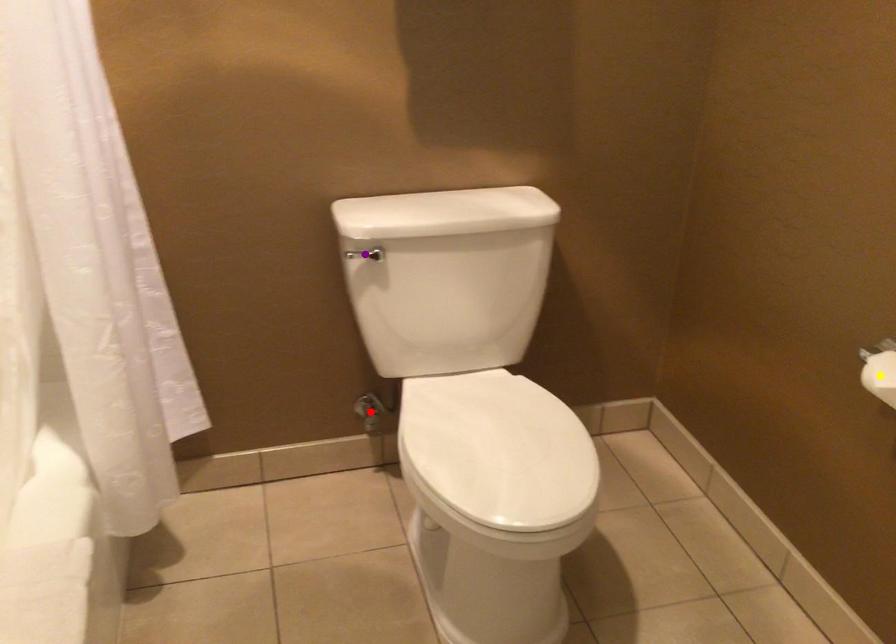
Order these from nearest to farthest:
1. yellow point
2. red point
3. purple point

yellow point → purple point → red point